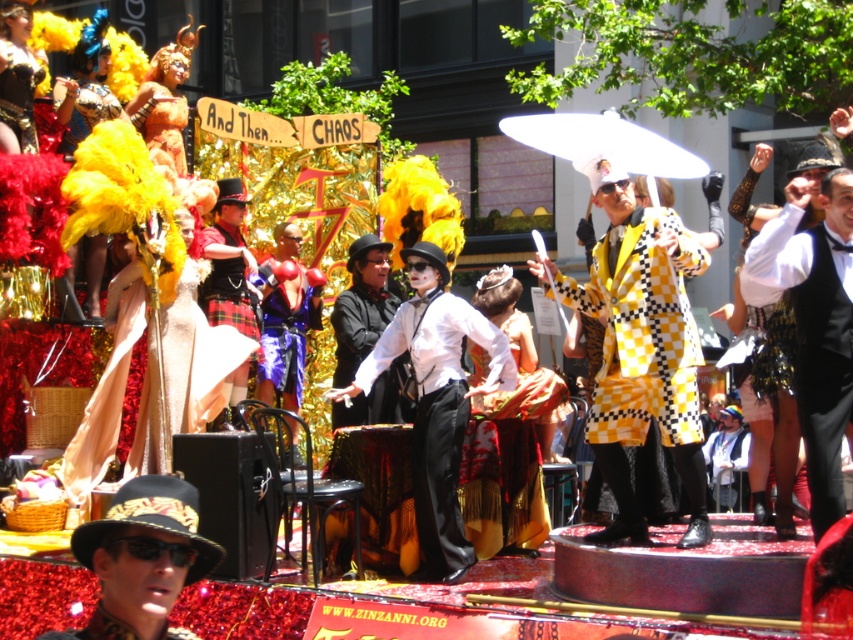
Does point (502, 348) come farther from viewer compared to point (338, 420)?

No, (502, 348) is closer to viewer.

Who is shorter, white glossy vest at center or white matte suit at center?

white matte suit at center

Between point (485, 388) and point (352, 416), which one is positioned behind?

The point (352, 416) is more distant.

I want to click on white glossy vest at center, so click(x=438, y=410).

Can you confirm if white glossy vest at center is thinner than velvet purple dress at center?

In fact, white glossy vest at center might be wider than velvet purple dress at center.

Is the position of white glossy vest at center more distant than that of velvet purple dress at center?

No, white glossy vest at center is closer to the viewer.

Which is in front, point (432, 362) or point (306, 276)?

Positioned in front is point (432, 362).

Find the location of a particular element. This screenshot has width=853, height=640. white glossy vest at center is located at coordinates (438, 410).

Who is positioned more to the left, yellow checkered coat at center or velvet purple dress at center?

velvet purple dress at center is more to the left.

You are a GUI agent. You are given a task and a screenshot of the screen. Output one action in this format:
    pyautogui.click(x=<x>, y=<y>)
    Task: Click on the yellow checkered coat at center
    This screenshot has width=853, height=640.
    Given the screenshot: What is the action you would take?
    pyautogui.click(x=643, y=353)